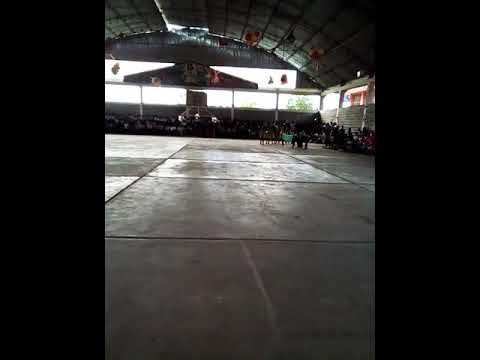
Where is `ceiling`? The height and width of the screenshot is (360, 480). ceiling is located at coordinates (254, 24).